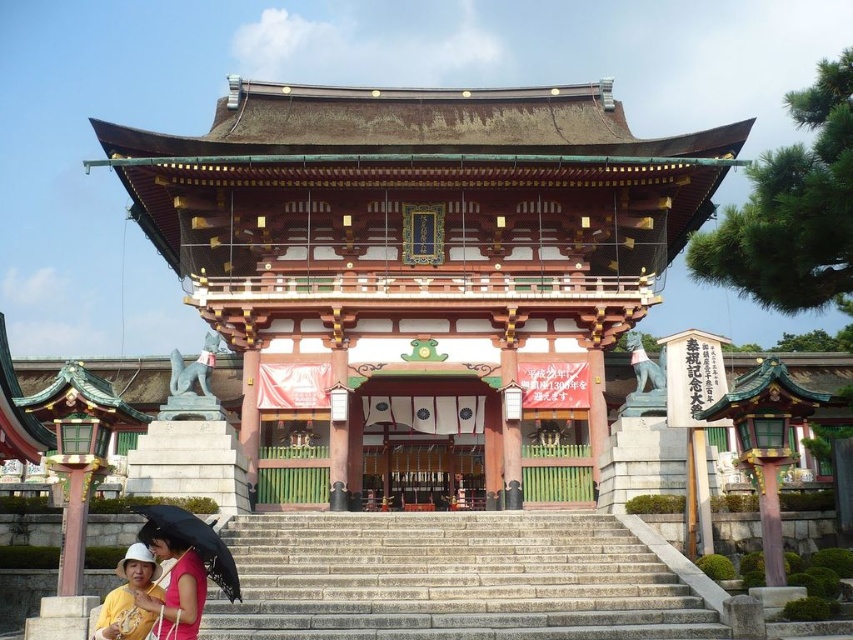
Looking at this image, is gray stone stairs at center below matte yellow shirt at lower left?

Yes, gray stone stairs at center is below matte yellow shirt at lower left.

Who is more forward, (421, 545) or (151, 611)?

Point (151, 611)

From the picture: Who is more forward, (569, 582) or (138, 595)?

Point (138, 595) is more forward.

Locate an element on the screen. This screenshot has width=853, height=640. gray stone stairs at center is located at coordinates (x=450, y=579).

Does gray stone stairs at center have a larger size compared to black matte umbrella at lower left?

Indeed, gray stone stairs at center has a larger size compared to black matte umbrella at lower left.

Is gray stone stairs at center smaller than black matte umbrella at lower left?

No.

Where is `gray stone stairs at center`? gray stone stairs at center is located at coordinates (450, 579).

The image size is (853, 640). In order to click on gray stone stairs at center in this screenshot , I will do `click(450, 579)`.

Does matte yellow shirt at lower left appear over black matte umbrella at lower left?

Yes.

Is matte yellow shirt at lower left bigger than black matte umbrella at lower left?

No.

The height and width of the screenshot is (640, 853). What do you see at coordinates (154, 592) in the screenshot?
I see `matte yellow shirt at lower left` at bounding box center [154, 592].

Find the location of a particular element. The image size is (853, 640). matte yellow shirt at lower left is located at coordinates (154, 592).